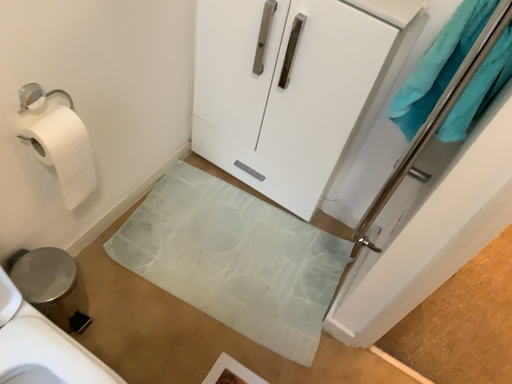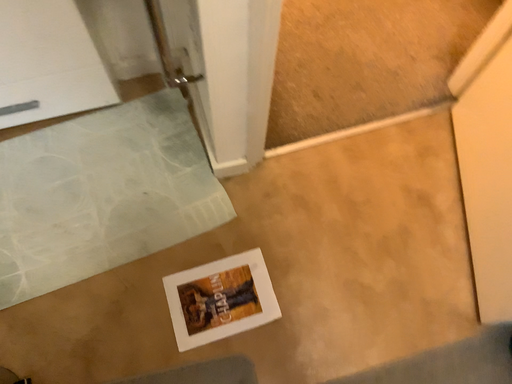
Question: Which way did the camera rotate in the video?

Choices:
 (A) rotated downward
 (B) rotated upward

Answer: (A)